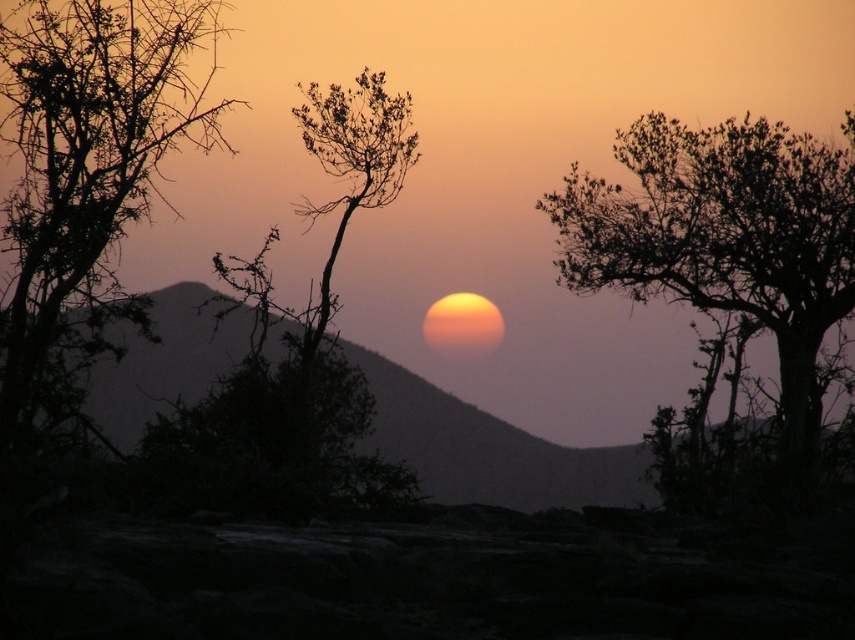
From the picture: You are an artist sketching the sunset scene. You notice the silhouette leafy tree at left and the bare branches at center. Which object is positioned higher in the image?

The silhouette leafy tree at left is positioned higher than the bare branches at center.

Based on the photo, you are standing in the sunset scene and want to take a photo of the silhouette leafy tree at upper right. If your camera has a maximum zoom range of 100 feet, will you be able to capture the tree clearly without moving closer?

The silhouette leafy tree at upper right is 104.09 feet away from the viewer. Since the camera can only zoom up to 100 feet, you will not be able to capture the tree clearly without moving closer.